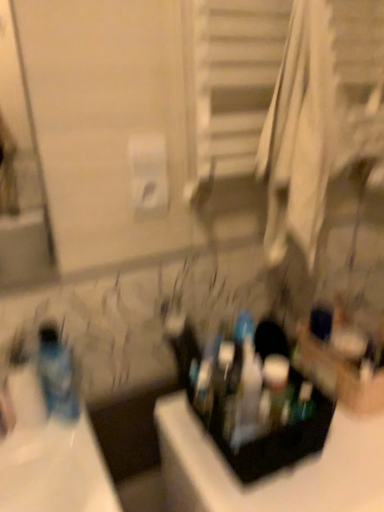
At what (x,y) coordinates should I click in order to perform the action: click on free space that is in between translucent plastic mouthwash at center and translucent plastic toothbrush at center. Please return your answer as a coordinate pair (x, y). The image size is (384, 512). Looking at the image, I should click on (257, 401).